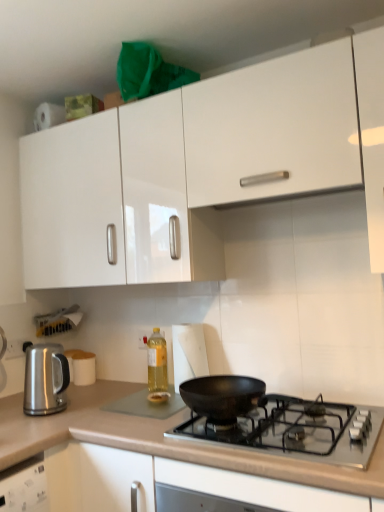
Question: Could you tell me if white matte cup at center-left is turned towards white glossy cabinet at upper center?

Choices:
 (A) yes
 (B) no

Answer: (B)

Question: Is white matte cup at center-left next to white glossy cabinet at upper center?

Choices:
 (A) yes
 (B) no

Answer: (B)

Question: Is white matte cup at center-left further to camera compared to white glossy cabinet at upper center?

Choices:
 (A) no
 (B) yes

Answer: (B)

Question: Is white matte cup at center-left positioned before white glossy cabinet at upper center?

Choices:
 (A) yes
 (B) no

Answer: (B)

Question: Can you confirm if white matte cup at center-left is thinner than white glossy cabinet at upper center?

Choices:
 (A) no
 (B) yes

Answer: (B)

Question: Is white paper towel at center taller or shorter than smooth beige countertop at lower center?

Choices:
 (A) tall
 (B) short

Answer: (B)

Question: Considering their positions, is white paper towel at center located in front of or behind smooth beige countertop at lower center?

Choices:
 (A) front
 (B) behind

Answer: (B)

Question: From the image's perspective, is white paper towel at center above or below smooth beige countertop at lower center?

Choices:
 (A) above
 (B) below

Answer: (A)

Question: Visually, is white paper towel at center positioned to the left or to the right of smooth beige countertop at lower center?

Choices:
 (A) left
 (B) right

Answer: (A)

Question: From a real-world perspective, is black matte pan at center physically located above or below translucent yellow liquid at center?

Choices:
 (A) below
 (B) above

Answer: (A)

Question: Looking at their shapes, would you say black matte pan at center is wider or thinner than translucent yellow liquid at center?

Choices:
 (A) wide
 (B) thin

Answer: (A)

Question: Is black matte pan at center in front of or behind translucent yellow liquid at center in the image?

Choices:
 (A) front
 (B) behind

Answer: (A)

Question: Is point (370, 426) positioned closer to the camera than point (160, 376)?

Choices:
 (A) farther
 (B) closer

Answer: (B)

Question: Looking at the image, does white paper towel at center seem bigger or smaller compared to white glossy cabinet at upper center?

Choices:
 (A) small
 (B) big

Answer: (A)

Question: Is point (175, 372) closer or farther from the camera than point (155, 274)?

Choices:
 (A) closer
 (B) farther

Answer: (B)